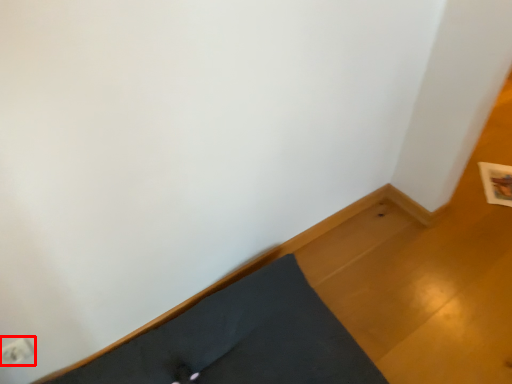
Question: Considering the relative positions of electric outlet (annotated by the red box) and bed frame in the image provided, where is electric outlet (annotated by the red box) located with respect to the staircase?

Choices:
 (A) left
 (B) right

Answer: (A)